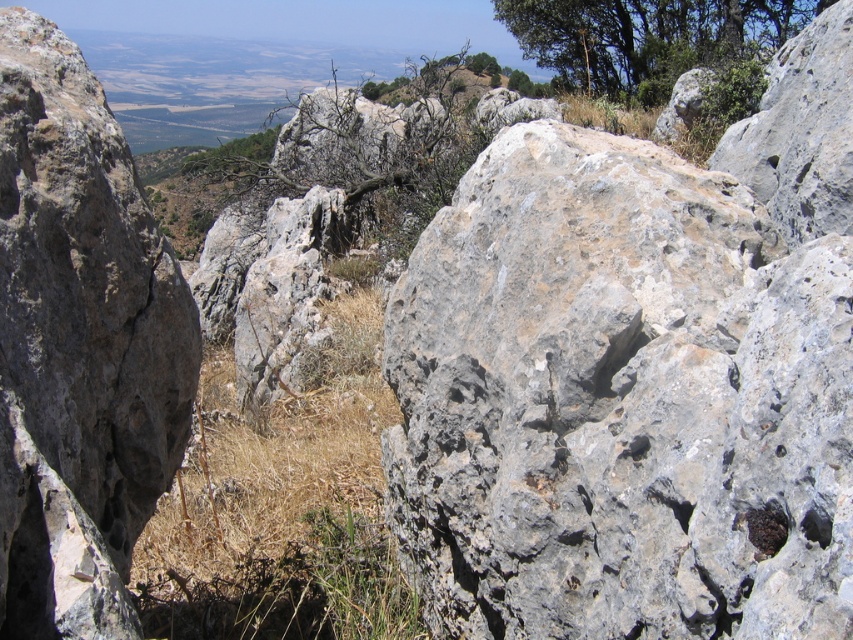
You are a hiker navigating through the rugged, rocky landscape. You see dry grass at center and a green leafy tree at upper right. Which object is positioned to the left of the other?

The dry grass at center is to the left of the green leafy tree at upper right.

You are a hiker trying to navigate through the rocky landscape. You notice dry grass at center and a green leafy tree at upper right. Which of these two landmarks is closer to your current position?

The dry grass at center is closer to your current position because it has a smaller size compared to the green leafy tree at upper right, indicating it is nearer in the scene.